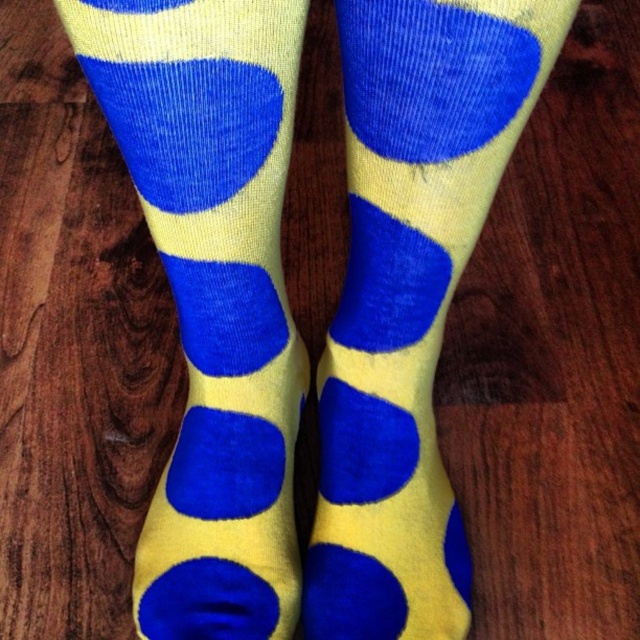
You are trying to decide which pair of socks to wear for a casual day out. You have two options in front of you on the wooden floor. The yellow corduroy socks at center and the matte yellow socks at center. Which pair is narrower?

The yellow corduroy socks at center are narrower than the matte yellow socks at center.

You are trying to take a photo of the bright yellow socks with large blue circles. The camera is set to focus on objects exactly 1 meter away. Will the point at point (296, 419) be in focus?

The point at point (296, 419) is 1.07 meters from the camera, which is slightly further than the 1 meter focus distance. Therefore, it will be slightly out of focus.

You are a fashion designer examining a closeup of two pairs of socks on a wooden floor. You notice the yellow corduroy socks at center and the matte yellow socks at center. Which pair is positioned higher in the image?

The yellow corduroy socks at center is above matte yellow socks at center, so the yellow corduroy socks at center is positioned higher in the image.